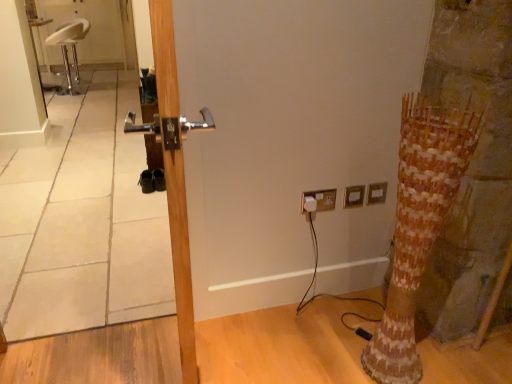
Find the location of `white plastic electric outlet at upper right, positioned as the 3th electric outlet in left-to-right order`. white plastic electric outlet at upper right, positioned as the 3th electric outlet in left-to-right order is located at coordinates (377, 193).

Image resolution: width=512 pixels, height=384 pixels. In order to click on gold metallic electric outlet at upper right, which is the second electric outlet from right to left in this screenshot , I will do `click(354, 196)`.

Describe the element at coordinates (66, 48) in the screenshot. I see `white leather stool at upper left` at that location.

Identify the location of wooden textured tree trunk at right. The image size is (512, 384). (418, 225).

Identify the location of white plastic socket at upper right, which is counted as the 1th electric outlet, starting from the left. (321, 199).

Image resolution: width=512 pixels, height=384 pixels. In order to click on white plastic electric outlet at upper right, positioned as the 3th electric outlet in left-to-right order in this screenshot , I will do `click(377, 193)`.

Is white leather stool at upper left taller than white plastic socket at upper right, the third electric outlet from the right?

Yes.

Are white leather stool at upper left and white plastic socket at upper right, which is counted as the 1th electric outlet, starting from the left, located far from each other?

Yes.

From the image's perspective, is white leather stool at upper left located above white plastic socket at upper right, which is counted as the 1th electric outlet, starting from the left?

Indeed, from the image's perspective, white leather stool at upper left is shown above white plastic socket at upper right, which is counted as the 1th electric outlet, starting from the left.

Does wooden door at center have a lesser width compared to white leather stool at upper left?

Indeed, wooden door at center has a lesser width compared to white leather stool at upper left.

Is wooden door at center spatially inside white leather stool at upper left, or outside of it?

wooden door at center lies outside white leather stool at upper left.

Could you tell me if wooden door at center is facing white leather stool at upper left?

No, wooden door at center is not turned towards white leather stool at upper left.

Considering the positions of point (179, 179) and point (70, 40), is point (179, 179) closer or farther from the camera than point (70, 40)?

Point (179, 179).

From the image's perspective, is white leather stool at upper left located beneath metallic silver mirror at left?

Incorrect, from the image's perspective, white leather stool at upper left is higher than metallic silver mirror at left.

From a real-world perspective, is white leather stool at upper left positioned under metallic silver mirror at left based on gravity?

Yes.

In the image, there is a metallic silver mirror at left. At what (x,y) coordinates should I click in order to perform the action: click on chair below it (from a real-world perspective). Please return your answer as a coordinate pair (x, y). The width and height of the screenshot is (512, 384). Looking at the image, I should click on (66, 48).

Do you think white leather stool at upper left is within metallic silver mirror at left, or outside of it?

white leather stool at upper left is spatially situated outside metallic silver mirror at left.

From the image's perspective, between wooden door at center and gold metallic electric outlet at upper right, the 2th electric outlet in the left-to-right sequence, which one is located above?

gold metallic electric outlet at upper right, the 2th electric outlet in the left-to-right sequence.

Considering the relative sizes of wooden door at center and gold metallic electric outlet at upper right, which is the second electric outlet from right to left, in the image provided, is wooden door at center thinner than gold metallic electric outlet at upper right, which is the second electric outlet from right to left,?

No.

Does wooden door at center have a smaller size compared to gold metallic electric outlet at upper right, which is the second electric outlet from right to left?

No.

Can you tell me how much white plastic electric outlet at upper right, which is the 1th electric outlet from right to left, and metallic silver mirror at left differ in facing direction?

There is a 0.469-degree angle between the facing directions of white plastic electric outlet at upper right, which is the 1th electric outlet from right to left, and metallic silver mirror at left.

The height and width of the screenshot is (384, 512). In the image, there is a white plastic electric outlet at upper right, which is the 1th electric outlet from right to left. Identify the location of mirror below it (from the image's perspective). (83, 223).

Is white plastic electric outlet at upper right, which is the 1th electric outlet from right to left, not within metallic silver mirror at left?

white plastic electric outlet at upper right, which is the 1th electric outlet from right to left, lies outside metallic silver mirror at left's area.

Considering the positions of points (373, 185) and (46, 228), is point (373, 185) closer to camera compared to point (46, 228)?

Yes, it is in front of point (46, 228).

Considering the points (151, 303) and (347, 207), which point is in front, point (151, 303) or point (347, 207)?

The point (347, 207) is closer to the camera.

What's the angular difference between metallic silver mirror at left and gold metallic electric outlet at upper right, which is the second electric outlet from right to left,'s facing directions?

There is a 0.469-degree angle between the facing directions of metallic silver mirror at left and gold metallic electric outlet at upper right, which is the second electric outlet from right to left.

Considering the relative positions of metallic silver mirror at left and gold metallic electric outlet at upper right, the 2th electric outlet in the left-to-right sequence, in the image provided, is metallic silver mirror at left to the left of gold metallic electric outlet at upper right, the 2th electric outlet in the left-to-right sequence, from the viewer's perspective?

Indeed, metallic silver mirror at left is positioned on the left side of gold metallic electric outlet at upper right, the 2th electric outlet in the left-to-right sequence.

Is metallic silver mirror at left in contact with gold metallic electric outlet at upper right, the 2th electric outlet in the left-to-right sequence?

metallic silver mirror at left and gold metallic electric outlet at upper right, the 2th electric outlet in the left-to-right sequence, are not in contact.

Considering the relative sizes of gold metallic electric outlet at upper right, the 2th electric outlet in the left-to-right sequence, and white plastic socket at upper right, which is counted as the 1th electric outlet, starting from the left, in the image provided, is gold metallic electric outlet at upper right, the 2th electric outlet in the left-to-right sequence, bigger than white plastic socket at upper right, which is counted as the 1th electric outlet, starting from the left,?

No, gold metallic electric outlet at upper right, the 2th electric outlet in the left-to-right sequence, is not bigger than white plastic socket at upper right, which is counted as the 1th electric outlet, starting from the left.

Which object is positioned more to the right, gold metallic electric outlet at upper right, the 2th electric outlet in the left-to-right sequence, or white plastic socket at upper right, which is counted as the 1th electric outlet, starting from the left?

Positioned to the right is gold metallic electric outlet at upper right, the 2th electric outlet in the left-to-right sequence.

Between point (359, 194) and point (318, 201), which one is positioned in front?

The point (318, 201) is more forward.

Find the location of a particular element. Image resolution: width=512 pixels, height=384 pixels. chair beneath the white plastic socket at upper right, which is counted as the 1th electric outlet, starting from the left (from a real-world perspective) is located at coordinates (x=66, y=48).

Locate an element on the screen. chair that is above the wooden door at center (from the image's perspective) is located at coordinates (66, 48).

From the image, which object appears to be nearer to white leather stool at upper left, white plastic socket at upper right, which is counted as the 1th electric outlet, starting from the left, or white plastic electric outlet at upper right, positioned as the 3th electric outlet in left-to-right order?

white plastic socket at upper right, which is counted as the 1th electric outlet, starting from the left.

Estimate the real-world distances between objects in this image. Which object is closer to white plastic electric outlet at upper right, positioned as the 3th electric outlet in left-to-right order, wooden door at center or white plastic socket at upper right, the third electric outlet from the right?

Among the two, white plastic socket at upper right, the third electric outlet from the right, is located nearer to white plastic electric outlet at upper right, positioned as the 3th electric outlet in left-to-right order.

In the scene shown: Which object lies nearer to the anchor point white leather stool at upper left, white plastic electric outlet at upper right, which is the 1th electric outlet from right to left, or wooden door at center?

white plastic electric outlet at upper right, which is the 1th electric outlet from right to left, lies closer to white leather stool at upper left than the other object.

Based on the photo, from the image, which object appears to be nearer to wooden door at center, gold metallic electric outlet at upper right, the 2th electric outlet in the left-to-right sequence, or metallic silver mirror at left?

gold metallic electric outlet at upper right, the 2th electric outlet in the left-to-right sequence, is closer to wooden door at center.

Looking at this image, when comparing their distances from metallic silver mirror at left, does wooden textured tree trunk at right or white plastic socket at upper right, the third electric outlet from the right, seem closer?

white plastic socket at upper right, the third electric outlet from the right, is closer to metallic silver mirror at left.

When comparing their distances from metallic silver mirror at left, does white leather stool at upper left or white plastic socket at upper right, the third electric outlet from the right, seem further?

Based on the image, white leather stool at upper left appears to be further to metallic silver mirror at left.

Based on their spatial positions, is white plastic electric outlet at upper right, which is the 1th electric outlet from right to left, or wooden door at center closer to wooden textured tree trunk at right?

The object closer to wooden textured tree trunk at right is white plastic electric outlet at upper right, which is the 1th electric outlet from right to left.

When comparing their distances from wooden door at center, does white leather stool at upper left or wooden textured tree trunk at right seem further?

white leather stool at upper left is positioned further to the anchor wooden door at center.

The width and height of the screenshot is (512, 384). What are the coordinates of `tree trunk located between wooden door at center and white leather stool at upper left in the depth direction` in the screenshot? It's located at [x=418, y=225].

You are a GUI agent. You are given a task and a screenshot of the screen. Output one action in this format:
    pyautogui.click(x=<x>, y=<y>)
    Task: Click on the tree trunk between metallic silver mirror at left and white plastic electric outlet at upper right, which is the 1th electric outlet from right to left
    Image resolution: width=512 pixels, height=384 pixels.
    Given the screenshot: What is the action you would take?
    pyautogui.click(x=418, y=225)

I want to click on tree trunk between wooden door at center and gold metallic electric outlet at upper right, which is the second electric outlet from right to left, from front to back, so click(418, 225).

Find the location of a particular element. This screenshot has width=512, height=384. mirror positioned between wooden door at center and white plastic socket at upper right, the third electric outlet from the right, from near to far is located at coordinates (83, 223).